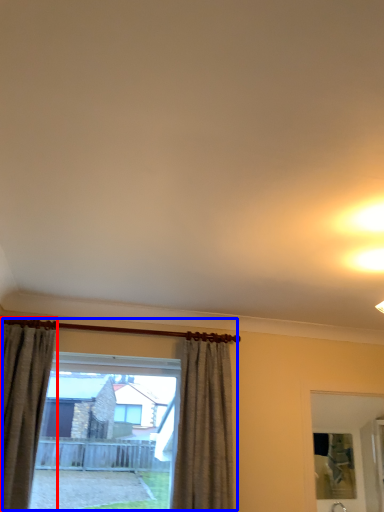
Question: Which object appears closest to the camera in this image, curtain (highlighted by a red box) or window (highlighted by a blue box)?

Choices:
 (A) curtain
 (B) window

Answer: (A)